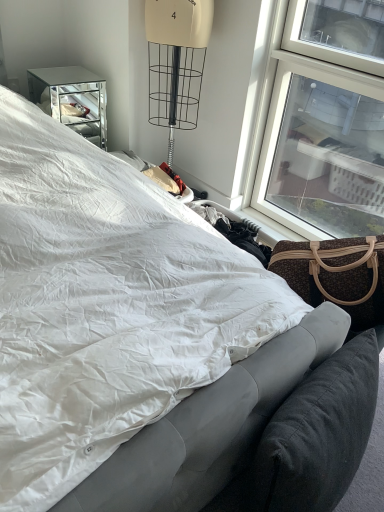
What is the approximate height of dark gray fabric swivel chair at lower right?

The height of dark gray fabric swivel chair at lower right is 20.27 inches.

Measure the distance between point (273, 486) and camera.

34.17 inches.

You are a GUI agent. You are given a task and a screenshot of the screen. Output one action in this format:
    pyautogui.click(x=<x>, y=<y>)
    Task: Click on the dark gray fabric swivel chair at lower right
    
    Given the screenshot: What is the action you would take?
    pyautogui.click(x=318, y=434)

Describe the element at coordinates (318, 434) in the screenshot. I see `dark gray fabric swivel chair at lower right` at that location.

Locate an element on the screen. This screenshot has height=512, width=384. dark gray fabric swivel chair at lower right is located at coordinates (318, 434).